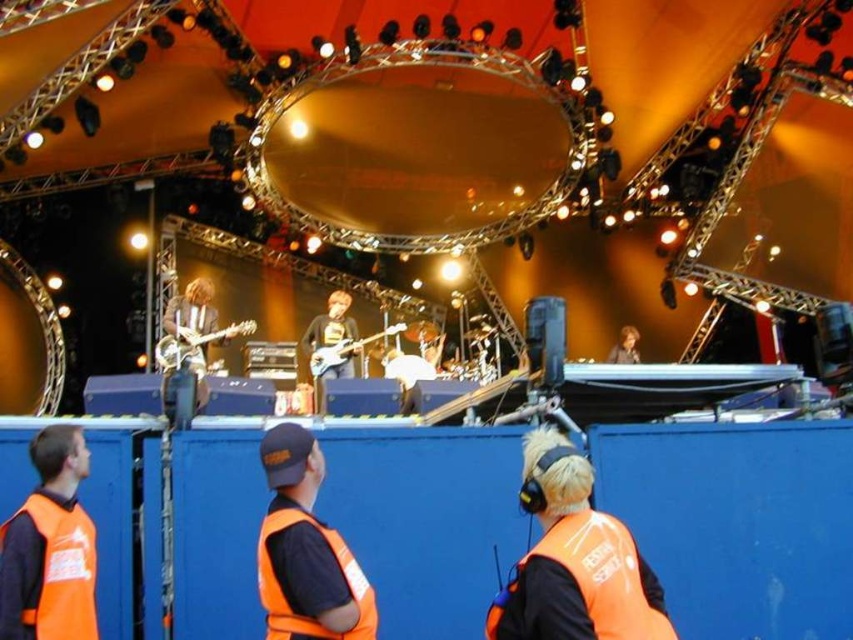
You are a stagehand preparing to move a piece of equipment to the center of the stage. You need to avoid the orange reflective vest at lower right. Where should you place the equipment so it doesn not block the vest?

Place the equipment away from the orange reflective vest at lower right, which is located at coordinates point (573, 561). Ensure the new position does not overlap with these coordinates.

You are a stagehand at the concert venue. You need to place a new microphone stand at point (573, 561). However, there is an orange reflective vest at lower right located at that point. Can you place the microphone stand there?

The orange reflective vest at lower right is located at point (573, 561), so the microphone stand cannot be placed there as the vest is already occupying that location.